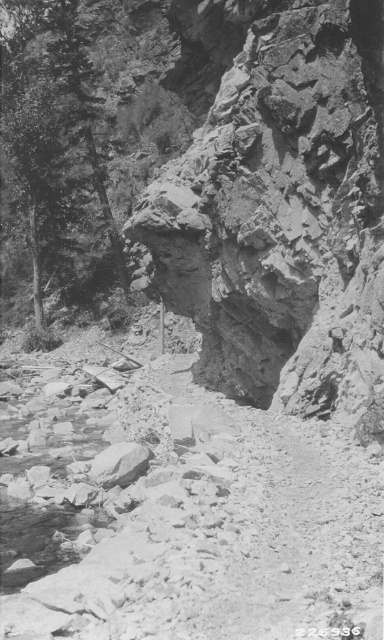
Question: In this image, where is rugged stone cliff at center located relative to smooth bark tree at upper left?

Choices:
 (A) below
 (B) above

Answer: (A)

Question: Which object appears closest to the camera in this image?

Choices:
 (A) rugged stone cliff at center
 (B) smooth bark tree at upper left

Answer: (A)

Question: Can you confirm if rugged stone cliff at center is positioned to the right of smooth bark tree at upper left?

Choices:
 (A) no
 (B) yes

Answer: (B)

Question: Does rugged stone cliff at center appear under smooth bark tree at upper left?

Choices:
 (A) no
 (B) yes

Answer: (B)

Question: Which point is farther to the camera?

Choices:
 (A) (69, 272)
 (B) (322, 182)

Answer: (A)